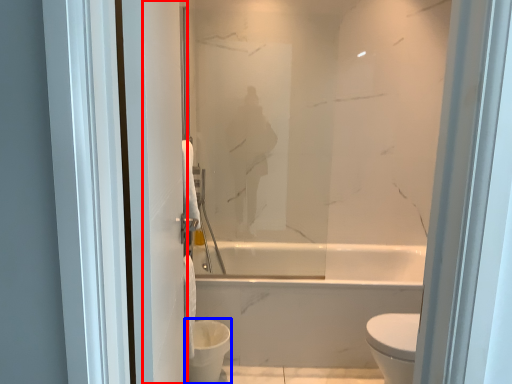
Question: Which of the following is the farthest to the observer, screen door (highlighted by a red box) or toilet bowl (highlighted by a blue box)?

Choices:
 (A) screen door
 (B) toilet bowl

Answer: (B)